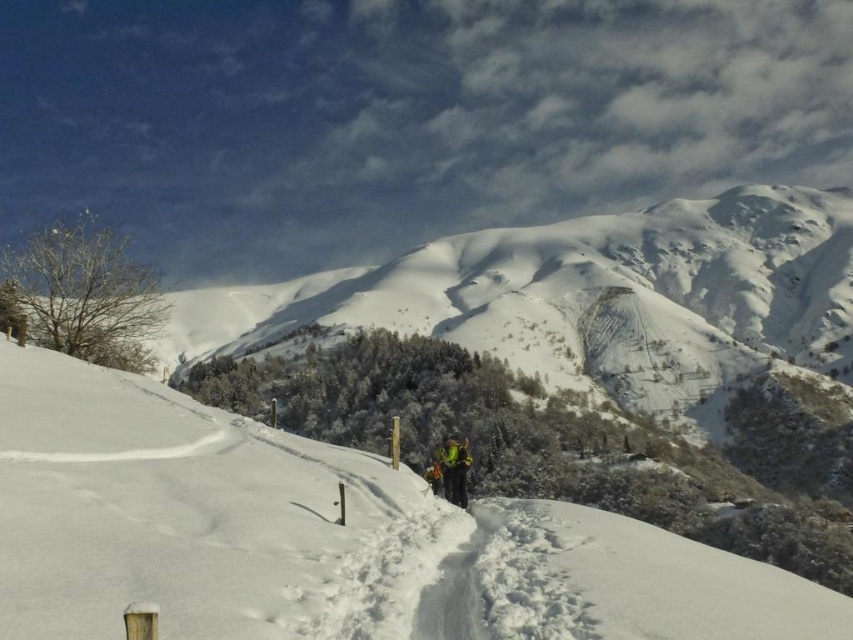
You are planning to take a photo of the white snow ski slope at center and the green fabric jacket at center. Which object should be in focus to ensure both are visible clearly in the photo?

The white snow ski slope at center should be in focus because it is positioned over the green fabric jacket at center, meaning they are at the same distance from the camera. This allows both to be in focus simultaneously.

You are planning to take a photo of the white snow ski slope at center and the green fabric jacket at center. Which object should you focus on if you want to capture both in the frame without cropping?

The white snow ski slope at center is wider than the green fabric jacket at center, so focusing on the slope will ensure both objects fit without cropping.